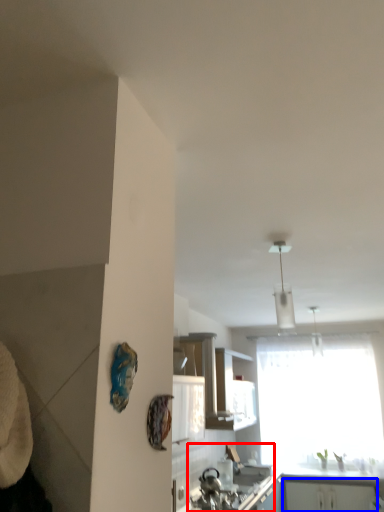
Question: Which object appears farthest to the camera in this image, sink (highlighted by a red box) or cabinetry (highlighted by a blue box)?

Choices:
 (A) sink
 (B) cabinetry

Answer: (B)